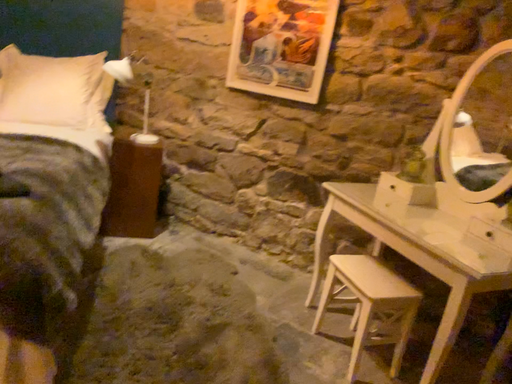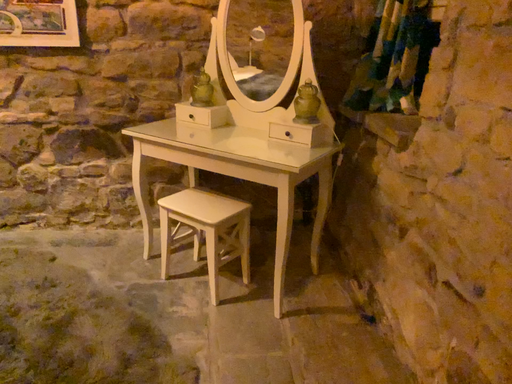
Question: How did the camera likely rotate when shooting the video?

Choices:
 (A) rotated left
 (B) rotated right

Answer: (B)